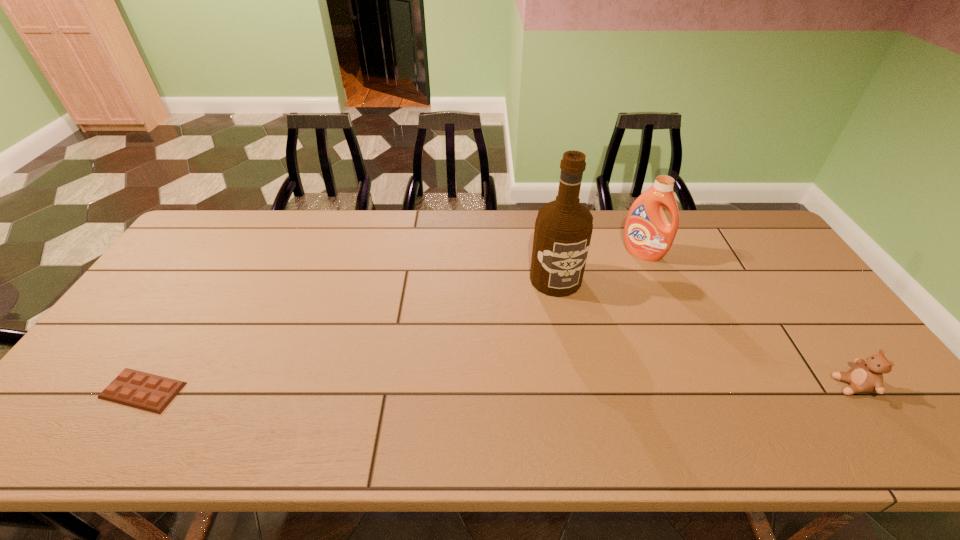
Find the location of a particular element. This screenshot has height=540, width=960. free spot on the desktop that is between the chocolate bar and the third tallest object and is positioned on the label of the second object from left to right is located at coordinates (600, 388).

Where is `vacant space on the desktop that is between the leftmost object and the second shortest object and is positioned on the front-facing side of the second object from right to left`? vacant space on the desktop that is between the leftmost object and the second shortest object and is positioned on the front-facing side of the second object from right to left is located at coordinates (542, 388).